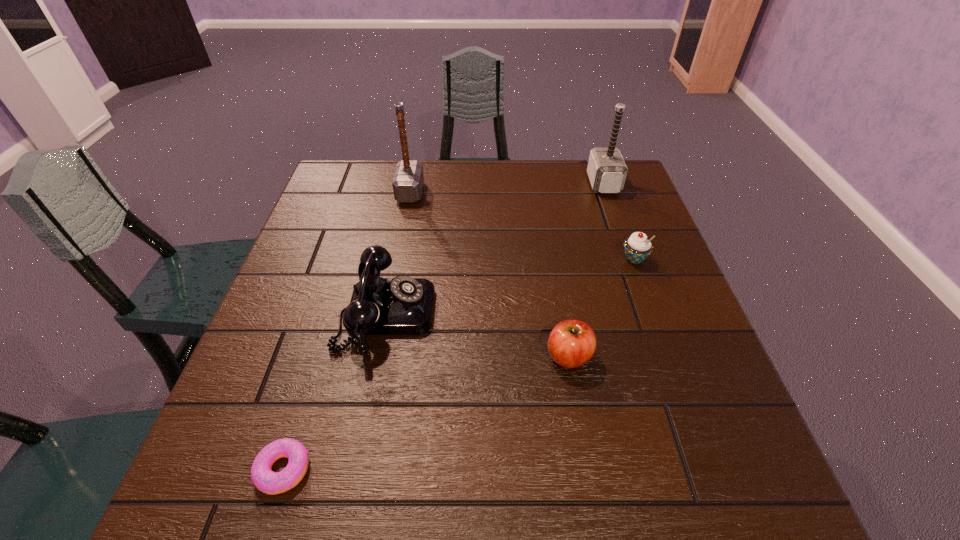
The width and height of the screenshot is (960, 540). In order to click on empty space that is in between the left hammer and the shortest object in this screenshot , I will do `click(347, 330)`.

Where is `free space between the right hammer and the left hammer`? The image size is (960, 540). free space between the right hammer and the left hammer is located at coordinates (507, 188).

Where is `vacant space that's between the left hammer and the fourth shortest object`? vacant space that's between the left hammer and the fourth shortest object is located at coordinates (398, 253).

You are a GUI agent. You are given a task and a screenshot of the screen. Output one action in this format:
    pyautogui.click(x=<x>, y=<y>)
    Task: Click on the free space between the telephone and the cupcake
    The width and height of the screenshot is (960, 540).
    Given the screenshot: What is the action you would take?
    pyautogui.click(x=510, y=286)

Where is `free spot between the doughnut and the telephone`? This screenshot has width=960, height=540. free spot between the doughnut and the telephone is located at coordinates (335, 391).

At what (x,y) coordinates should I click in order to perform the action: click on empty space between the doughnut and the third object from right to left. Please return your answer as a coordinate pair (x, y). Image resolution: width=960 pixels, height=540 pixels. Looking at the image, I should click on pyautogui.click(x=426, y=413).

The width and height of the screenshot is (960, 540). Identify the location of free space between the third object from right to left and the left hammer. (490, 274).

Locate an element on the screen. The width and height of the screenshot is (960, 540). empty space between the nearest object and the cupcake is located at coordinates (459, 364).

The image size is (960, 540). Identify the location of object that is the second closest one to the left hammer. (606, 169).

The image size is (960, 540). I want to click on the fourth closest object to the cupcake, so click(x=408, y=179).